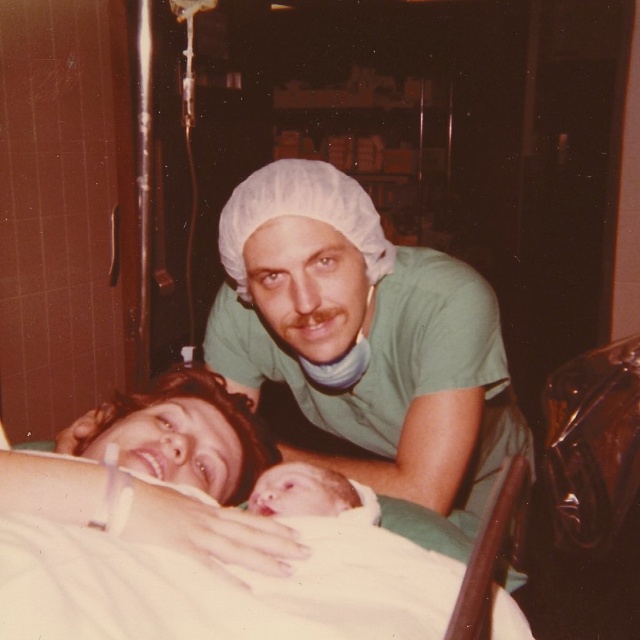
Question: Where is green smooth shirt at upper center located in relation to smooth skin newborn at center in the image?

Choices:
 (A) above
 (B) below

Answer: (A)

Question: Is green smooth shirt at upper center positioned behind smooth skin newborn at center?

Choices:
 (A) yes
 (B) no

Answer: (A)

Question: Which of the following is the farthest from the observer?

Choices:
 (A) (301, 273)
 (B) (10, 474)

Answer: (A)

Question: Which of the following is the farthest from the observer?

Choices:
 (A) (342, 490)
 (B) (300, 333)

Answer: (B)

Question: Which object is the farthest from the green smooth shirt at upper center?

Choices:
 (A) smooth skin face at center
 (B) smooth skin newborn at center

Answer: (B)

Question: Can you confirm if smooth skin face at center is thinner than smooth skin newborn at center?

Choices:
 (A) no
 (B) yes

Answer: (A)